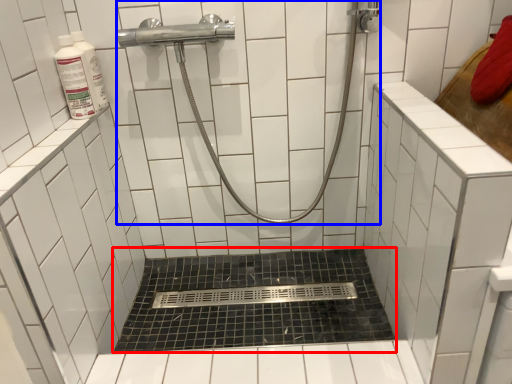
Question: Which point is further to the camera, bath (highlighted by a red box) or shower (highlighted by a blue box)?

Choices:
 (A) bath
 (B) shower

Answer: (A)